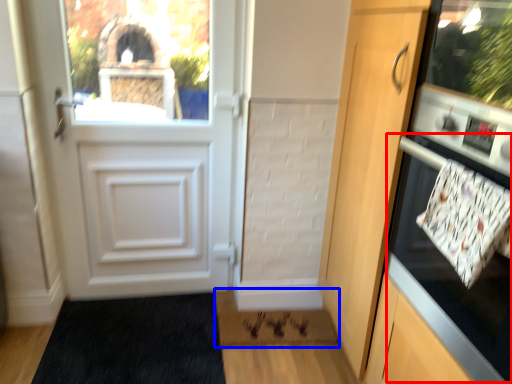
Question: Among these objects, which one is farthest to the camera, oven (highlighted by a red box) or doormat (highlighted by a blue box)?

Choices:
 (A) oven
 (B) doormat

Answer: (B)